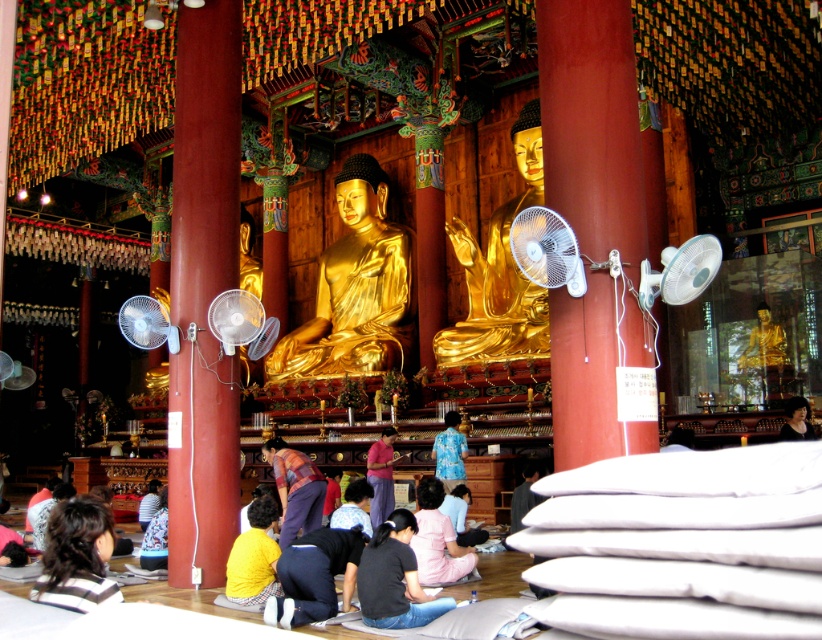
You are a visitor standing in the temple and notice a point at coordinate (680, 272). What object is located at that point?

The white plastic fan at right is located at point (680, 272).

You are a visitor standing at the entrance of the temple and want to take a photo of both the gold polished statue at center and the blue floral shirt at center. Which object should you focus on first to ensure it appears clearer in the photo?

The gold polished statue at center is further to the viewer than the blue floral shirt at center, so you should focus on the gold polished statue at center first to ensure it appears clearer in the photo.